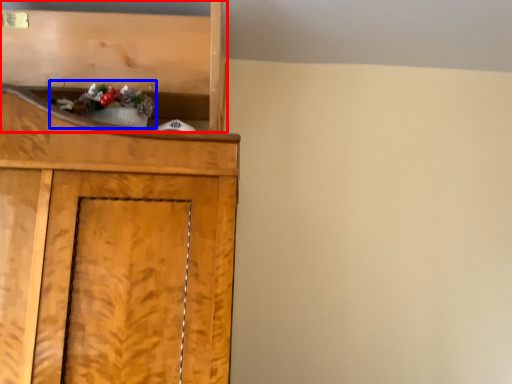
Question: Which point is further to the camera, shelf (highlighted by a red box) or christmas decoration (highlighted by a blue box)?

Choices:
 (A) shelf
 (B) christmas decoration

Answer: (A)